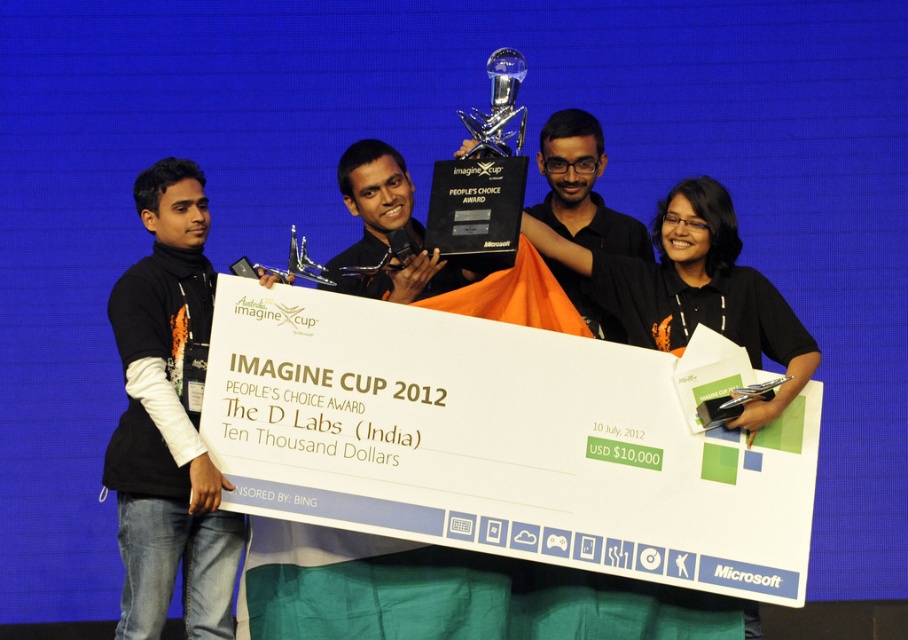
Based on the scene description, which individual is positioned lower in the image between the black turtleneck sweater at left and the black matte shirt at center?

The black turtleneck sweater at left is positioned below the black matte shirt at center, so the individual wearing the black turtleneck sweater at left is lower in the image.

You are a photographer at the event and want to capture a closeup of the clear glass trophy at center without the black turtleneck sweater at left being visible in the shot. Is this possible given their positions and sizes?

The black turtleneck sweater at left is thinner than the clear glass trophy at center, so it is possible to frame the shot such that the trophy occupies more of the frame, potentially obscuring the sweater or positioning it outside the camera view.